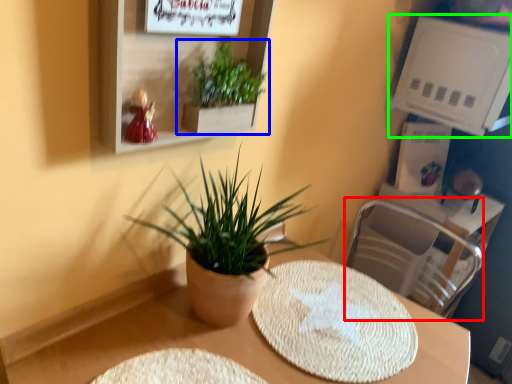
Question: Based on their relative distances, which object is nearer to swivel chair (highlighted by a red box)? Choose from houseplant (highlighted by a blue box) and shelf (highlighted by a green box).

Choices:
 (A) houseplant
 (B) shelf

Answer: (B)